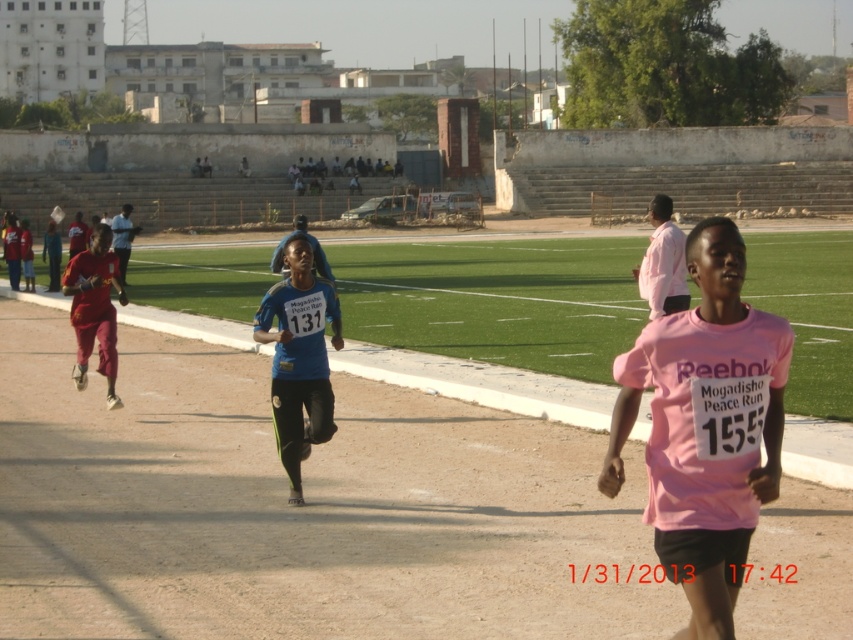
Which is in front, point (312, 284) or point (99, 371)?

Point (312, 284) is in front.

Who is positioned more to the right, blue matte running shirt at center or matte red shorts at left?

blue matte running shirt at center

Where is `blue matte running shirt at center`? blue matte running shirt at center is located at coordinates (299, 356).

In order to click on blue matte running shirt at center in this screenshot , I will do `click(299, 356)`.

Looking at this image, which is more to the left, pink matte shirt at center or blue matte running shirt at center?

blue matte running shirt at center is more to the left.

Does pink matte shirt at center have a smaller size compared to blue matte running shirt at center?

Actually, pink matte shirt at center might be larger than blue matte running shirt at center.

Locate an element on the screen. This screenshot has width=853, height=640. pink matte shirt at center is located at coordinates (705, 426).

The height and width of the screenshot is (640, 853). I want to click on pink matte shirt at center, so click(x=705, y=426).

The width and height of the screenshot is (853, 640). I want to click on pink matte shirt at center, so click(x=705, y=426).

At what (x,y) coordinates should I click in order to perform the action: click on pink matte shirt at center. Please return your answer as a coordinate pair (x, y). Image resolution: width=853 pixels, height=640 pixels. Looking at the image, I should click on (705, 426).

This screenshot has height=640, width=853. Find the location of `pink matte shirt at center`. pink matte shirt at center is located at coordinates (705, 426).